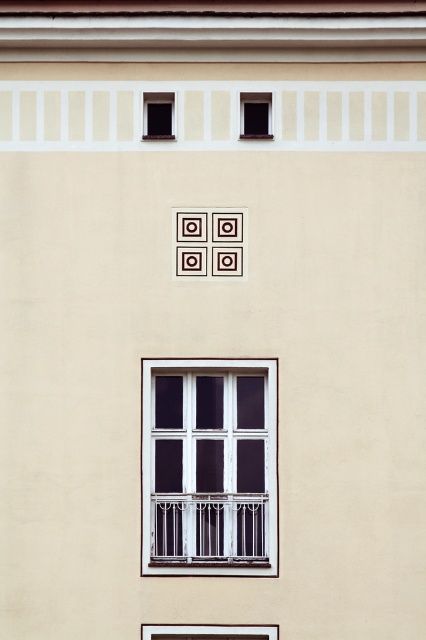
Question: In this image, where is white painted wood window at center located relative to matte black window at upper left?

Choices:
 (A) left
 (B) right

Answer: (B)

Question: Is matte black window at upper left closer to camera compared to transparent glass window at upper center?

Choices:
 (A) no
 (B) yes

Answer: (B)

Question: Which point is farther to the camera?

Choices:
 (A) (203, 488)
 (B) (167, 132)
 (C) (258, 102)
 (D) (236, 628)

Answer: (C)

Question: Which object appears farthest from the camera in this image?

Choices:
 (A) white glass window at center
 (B) white painted wood window at center
 (C) transparent glass window at upper center
 (D) matte black window at upper left

Answer: (C)

Question: Is white glass window at center positioned at the back of matte black window at upper left?

Choices:
 (A) no
 (B) yes

Answer: (A)

Question: Among these points, which one is farthest from the camera?

Choices:
 (A) click(264, 120)
 (B) click(230, 636)
 (C) click(181, 560)
 (D) click(150, 99)

Answer: (A)